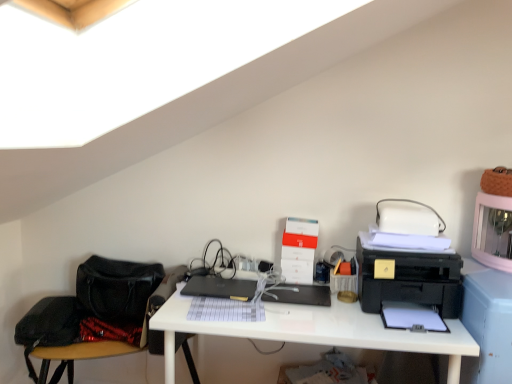
The width and height of the screenshot is (512, 384). What do you see at coordinates (300, 294) in the screenshot?
I see `black plastic register at center` at bounding box center [300, 294].

Find the location of a particular element. This screenshot has height=384, width=512. white cardboard box at center is located at coordinates (298, 250).

Describe the element at coordinates (96, 314) in the screenshot. The height and width of the screenshot is (384, 512). I see `black leather swivel chair at lower left` at that location.

What is the approximate height of black leather swivel chair at lower left?

black leather swivel chair at lower left is 16.74 inches in height.

Image resolution: width=512 pixels, height=384 pixels. What do you see at coordinates (220, 288) in the screenshot?
I see `black matte laptop at center` at bounding box center [220, 288].

Identify the location of black plastic register at center. (300, 294).

Does black plastic printer at right have a lesser height compared to black plastic register at center?

Incorrect, the height of black plastic printer at right does not fall short of that of black plastic register at center.

From a real-world perspective, which is physically above, black plastic printer at right or black plastic register at center?

From a 3D spatial view, black plastic printer at right is above.

Relative to black plastic register at center, is black plastic printer at right in front or behind?

black plastic printer at right is positioned closer to the viewer than black plastic register at center.

How distant is black plastic printer at right from black plastic register at center?

black plastic printer at right and black plastic register at center are 35.60 centimeters apart from each other.

Does point (173, 288) come closer to viewer compared to point (247, 294)?

Yes, it is.

Would you say black leather swivel chair at lower left contains black matte laptop at center?

No, black matte laptop at center is not surrounded by black leather swivel chair at lower left.

From a real-world perspective, is black leather swivel chair at lower left on top of black matte laptop at center?

Incorrect, from a real-world perspective, black leather swivel chair at lower left is lower than black matte laptop at center.

Which of these two, black leather swivel chair at lower left or black matte laptop at center, is thinner?

black matte laptop at center.

From the image's perspective, is black leather swivel chair at lower left positioned above or below white glossy desk at center?

Clearly, from the image's perspective, black leather swivel chair at lower left is below white glossy desk at center.

Can you confirm if black leather swivel chair at lower left is thinner than white glossy desk at center?

No.

Could you tell me if black leather swivel chair at lower left is turned towards white glossy desk at center?

No, black leather swivel chair at lower left is not aimed at white glossy desk at center.

Looking at this image, is white glossy desk at center inside black leather swivel chair at lower left?

No, white glossy desk at center is not surrounded by black leather swivel chair at lower left.

Is white glossy desk at center situated inside black matte laptop at center or outside?

white glossy desk at center cannot be found inside black matte laptop at center.

Is point (378, 343) positioned before point (246, 282)?

Yes, point (378, 343) is in front of point (246, 282).

From a real-world perspective, does white glossy desk at center stand above black matte laptop at center?

Incorrect, from a real-world perspective, white glossy desk at center is lower than black matte laptop at center.

Considering the relative positions of white glossy desk at center and black matte laptop at center in the image provided, is white glossy desk at center to the right of black matte laptop at center from the viewer's perspective?

Indeed, white glossy desk at center is positioned on the right side of black matte laptop at center.

From the image's perspective, which object appears higher, white glossy desk at center or black plastic register at center?

From the image's view, black plastic register at center is above.

Considering the sizes of objects white glossy desk at center and black plastic register at center in the image provided, who is bigger, white glossy desk at center or black plastic register at center?

With larger size is white glossy desk at center.

Based on the photo, considering their positions, is white glossy desk at center located in front of or behind black plastic register at center?

white glossy desk at center is positioned closer to the viewer than black plastic register at center.

From a real-world perspective, does black plastic register at center stand above black plastic printer at right?

Incorrect, from a real-world perspective, black plastic register at center is lower than black plastic printer at right.

Would you say black plastic printer at right is part of black plastic register at center's contents?

No, black plastic printer at right is not surrounded by black plastic register at center.

Find the location of a particular element. This screenshot has height=384, width=512. register behind the black plastic printer at right is located at coordinates (300, 294).

From the picture: Is black plastic register at center smaller than black plastic printer at right?

Correct, black plastic register at center occupies less space than black plastic printer at right.

Is black plastic printer at right oriented away from white cardboard box at center?

No, black plastic printer at right's orientation is not away from white cardboard box at center.

From the image's perspective, between black plastic printer at right and white cardboard box at center, which one is located above?

white cardboard box at center, from the image's perspective.

In the scene shown: Is white cardboard box at center surrounded by black plastic printer at right?

No, white cardboard box at center is not a part of black plastic printer at right.

Locate an element on the screen. office supplies lying behind the black plastic printer at right is located at coordinates (298, 250).

Image resolution: width=512 pixels, height=384 pixels. What are the coordinates of `printer on the right of black plastic register at center` in the screenshot? It's located at (411, 280).

You are a GUI agent. You are given a task and a screenshot of the screen. Output one action in this format:
    pyautogui.click(x=<x>, y=<y>)
    Task: Click on the laptop that appears behind the black leather swivel chair at lower left
    
    Given the screenshot: What is the action you would take?
    pyautogui.click(x=220, y=288)

Based on their spatial positions, is black plastic printer at right or black plastic register at center closer to white glossy desk at center?

black plastic register at center lies closer to white glossy desk at center than the other object.

Which object lies further to the anchor point black matte laptop at center, black plastic printer at right or white cardboard box at center?

The object further to black matte laptop at center is black plastic printer at right.

Based on their spatial positions, is black matte laptop at center or white glossy desk at center closer to white cardboard box at center?

black matte laptop at center is closer to white cardboard box at center.

Looking at the image, which one is located closer to black plastic printer at right, black matte laptop at center or white cardboard box at center?

white cardboard box at center lies closer to black plastic printer at right than the other object.

From the image, which object appears to be nearer to black plastic printer at right, black plastic register at center or white cardboard box at center?

Based on the image, black plastic register at center appears to be nearer to black plastic printer at right.

From the image, which object appears to be farther from black plastic printer at right, white cardboard box at center or white glossy desk at center?

white cardboard box at center lies further to black plastic printer at right than the other object.

Based on their spatial positions, is white cardboard box at center or black plastic printer at right further from black matte laptop at center?

The object further to black matte laptop at center is black plastic printer at right.

Which object lies further to the anchor point black plastic printer at right, white glossy desk at center or black matte laptop at center?

Based on the image, black matte laptop at center appears to be further to black plastic printer at right.

The width and height of the screenshot is (512, 384). In order to click on laptop situated between black leather swivel chair at lower left and white glossy desk at center from left to right in this screenshot , I will do [x=220, y=288].

Identify the location of register between black matte laptop at center and white glossy desk at center from left to right. This screenshot has height=384, width=512. (300, 294).

This screenshot has width=512, height=384. I want to click on office supplies between black leather swivel chair at lower left and black plastic printer at right, so click(x=298, y=250).

Identify the location of office supplies between black matte laptop at center and black plastic printer at right from left to right. (298, 250).